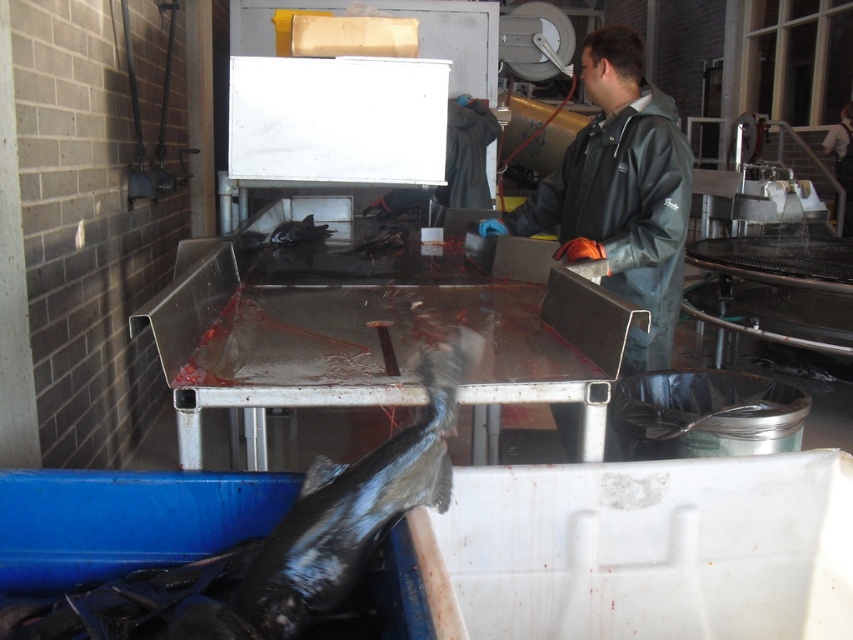
Does point (676, 275) come farther from viewer compared to point (463, 340)?

Yes, point (676, 275) is farther from viewer.

Does black leather jacket at center appear under shiny black fish at lower left?

Actually, black leather jacket at center is above shiny black fish at lower left.

Between point (660, 300) and point (270, 545), which one is positioned behind?

The point (660, 300) is behind.

Locate an element on the screen. black leather jacket at center is located at coordinates (619, 193).